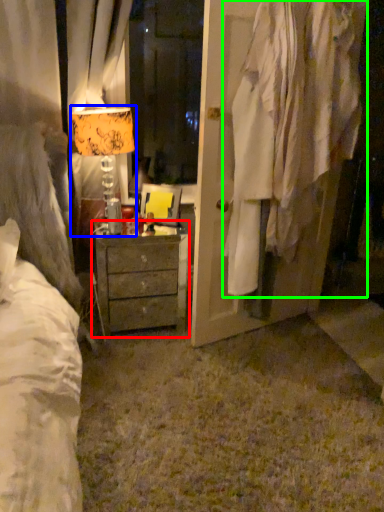
Question: Which object is positioned farthest from chest of drawers (highlighted by a red box)? Select from table lamp (highlighted by a blue box) and clothing (highlighted by a green box).

Choices:
 (A) table lamp
 (B) clothing

Answer: (B)